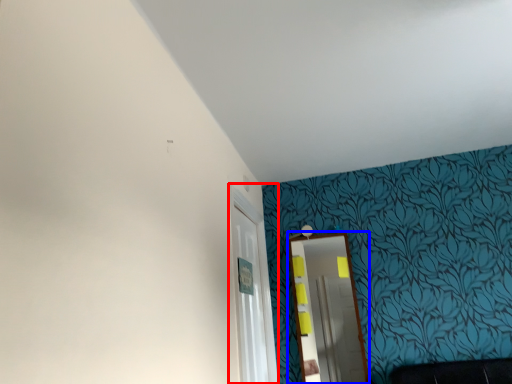
Question: Which of the following is the farthest to the observer, glass door (highlighted by a red box) or mirror (highlighted by a blue box)?

Choices:
 (A) glass door
 (B) mirror

Answer: (B)